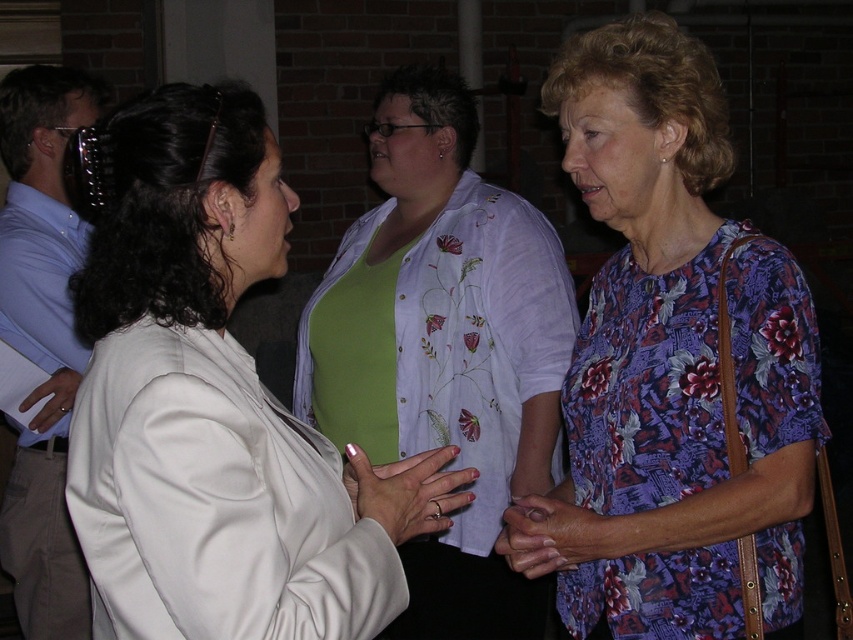
You are trying to locate two people in the scene based on their clothing. Which person is positioned to the right of the other between the floral print blouse at center and the light blue shirt at left?

The floral print blouse at center is positioned to the right of the light blue shirt at left.

You are a photographer trying to capture a clear shot of both the floral print blouse at center and the floral fabric hand at center. Which object is closer to the camera, allowing it to be in focus?

The floral print blouse at center is positioned over the floral fabric hand at center, so it is closer to the camera and will be in focus.